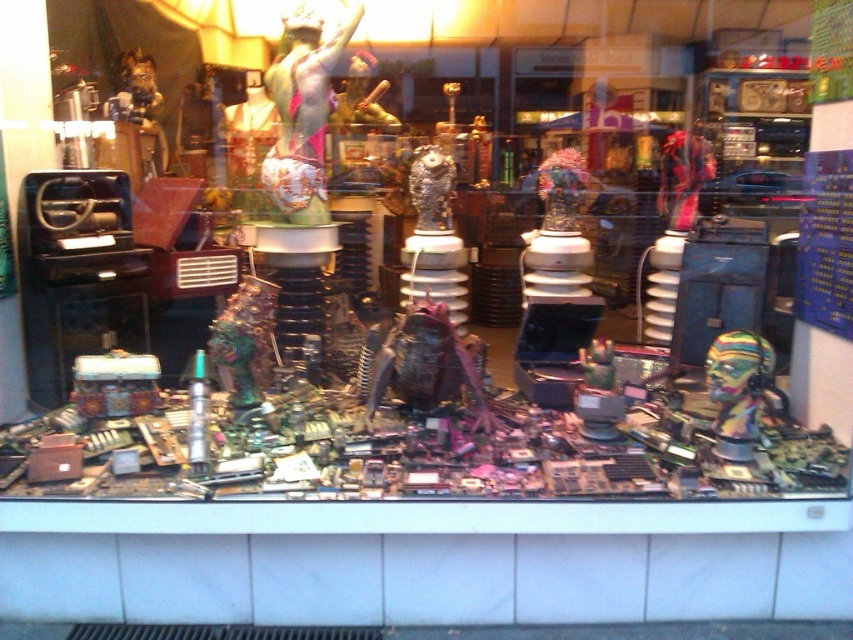
Question: Considering the relative positions of metallic green statue at center and multicolored plastic head at center in the image provided, where is metallic green statue at center located with respect to multicolored plastic head at center?

Choices:
 (A) above
 (B) below

Answer: (A)

Question: Which object is closer to the camera taking this photo?

Choices:
 (A) multicolored plastic head at center
 (B) metallic green statue at center

Answer: (A)

Question: Can you confirm if metallic green statue at center is positioned to the left of multicolored plastic head at center?

Choices:
 (A) no
 (B) yes

Answer: (B)

Question: Does metallic green statue at center appear under multicolored plastic head at center?

Choices:
 (A) no
 (B) yes

Answer: (A)

Question: Which point is closer to the camera?

Choices:
 (A) multicolored plastic head at center
 (B) metallic green statue at center

Answer: (A)